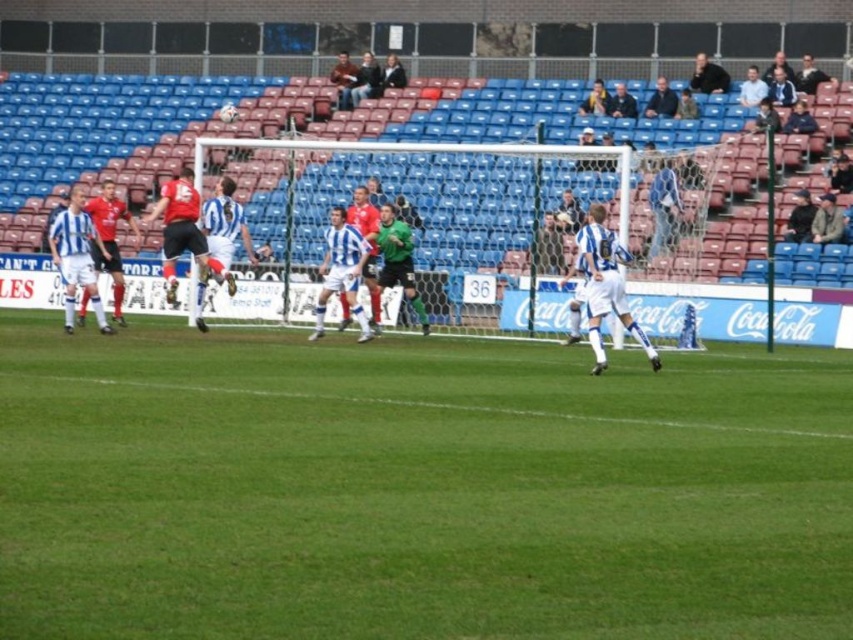
You are a photographer at the soccer match and want to capture both the dark blue shirt at upper center and the dark blue shirt at upper right in a single shot. Which shirt will appear closer to the top of the photo?

The dark blue shirt at upper center will appear closer to the top of the photo because it is positioned over the dark blue shirt at upper right.

You are a soccer player standing on the field. You notice the green grass at center and the dark blue shirt at upper center. Which object is higher in elevation?

The green grass at center is much taller than the dark blue shirt at upper center, so the green grass at center is higher in elevation.